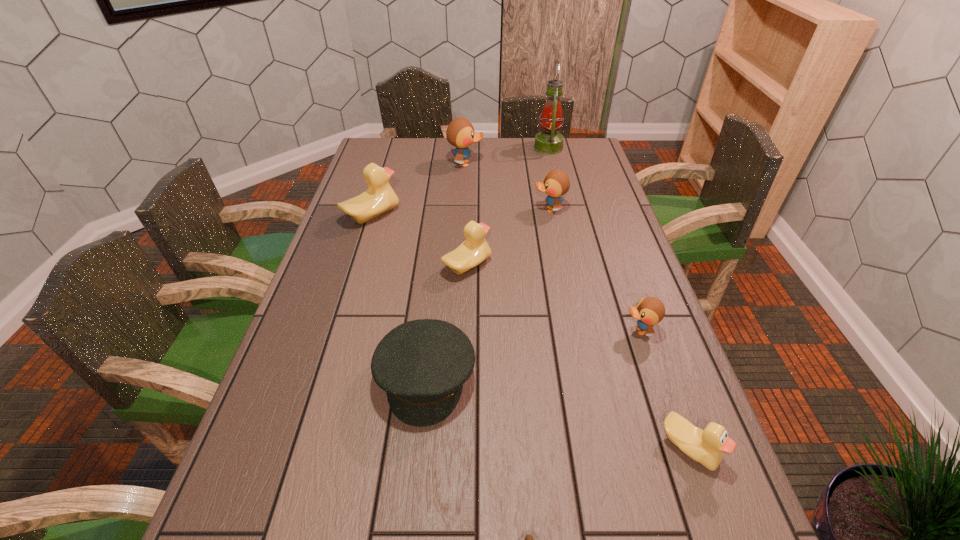
Locate an element on the screen. This screenshot has width=960, height=540. oil lamp is located at coordinates (548, 142).

You are a GUI agent. You are given a task and a screenshot of the screen. Output one action in this format:
    pyautogui.click(x=<x>, y=<y>)
    Task: Click on the green oil lamp
    Image resolution: width=960 pixels, height=540 pixels.
    Given the screenshot: What is the action you would take?
    [548, 142]

Locate an element on the screen. the farthest duck is located at coordinates pyautogui.click(x=460, y=133).

Locate an element on the screen. The height and width of the screenshot is (540, 960). the farthest blue duck is located at coordinates (460, 133).

Identify the location of the biggest beige duck. This screenshot has width=960, height=540. coord(379,198).

The height and width of the screenshot is (540, 960). In order to click on the leftmost beige duck in this screenshot , I will do `click(379, 198)`.

The width and height of the screenshot is (960, 540). Find the location of `the second biggest blue duck`. the second biggest blue duck is located at coordinates click(556, 183).

Find the location of a particular element. the second blue duck from left to right is located at coordinates (556, 183).

You are a GUI agent. You are given a task and a screenshot of the screen. Output one action in this format:
    pyautogui.click(x=<x>, y=<y>)
    Task: Click on the third nearest duck
    The width and height of the screenshot is (960, 540).
    Given the screenshot: What is the action you would take?
    pyautogui.click(x=474, y=250)

The image size is (960, 540). Identify the location of the second smallest beige duck. (474, 250).